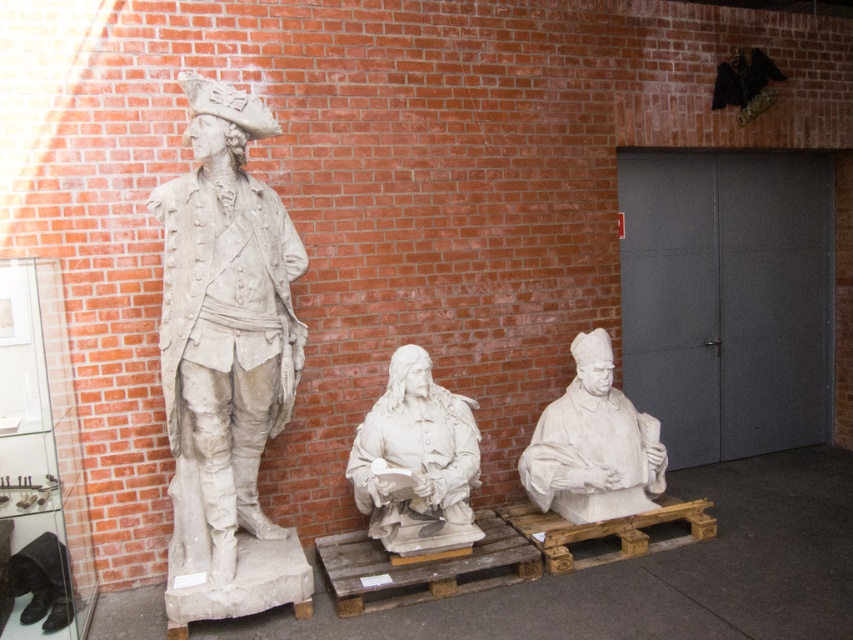
Question: Can you confirm if white stone statue at left is bigger than white marble bust at center?

Choices:
 (A) no
 (B) yes

Answer: (B)

Question: Estimate the real-world distances between objects in this image. Which object is closer to the white marble bust at center?

Choices:
 (A) white stone statue at left
 (B) white stone bust at center

Answer: (B)

Question: Which point is closer to the camera taking this photo?

Choices:
 (A) (589, 352)
 (B) (291, 339)

Answer: (B)

Question: Which point is farther to the camera?

Choices:
 (A) (370, 449)
 (B) (248, 109)
 (C) (610, 372)

Answer: (C)

Question: Can you confirm if white stone bust at center is thinner than white marble bust at center?

Choices:
 (A) yes
 (B) no

Answer: (A)

Question: Is white stone statue at left smaller than white stone bust at center?

Choices:
 (A) no
 (B) yes

Answer: (A)